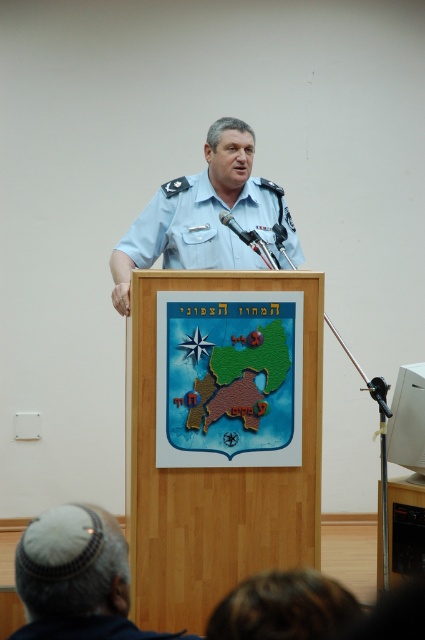
Which is in front, point (116, 550) or point (84, 636)?

Point (84, 636)

Locate an element on the screen. white wool kippah at lower left is located at coordinates (76, 577).

This screenshot has width=425, height=640. I want to click on white wool kippah at lower left, so click(x=76, y=577).

Which is behind, point (99, 612) or point (195, 216)?

Positioned behind is point (195, 216).

Can you confirm if white wool kippah at lower left is positioned above blue uniform at center?

Incorrect, white wool kippah at lower left is not positioned above blue uniform at center.

Which is behind, point (45, 522) or point (172, 253)?

The point (172, 253) is more distant.

The image size is (425, 640). I want to click on white wool kippah at lower left, so click(x=76, y=577).

Can you confirm if blue uniform at center is taller than blue fabric uniform at center?

Yes, blue uniform at center is taller than blue fabric uniform at center.

Can you confirm if blue uniform at center is positioned to the right of blue fabric uniform at center?

Indeed, blue uniform at center is positioned on the right side of blue fabric uniform at center.

This screenshot has width=425, height=640. I want to click on blue uniform at center, so click(186, 230).